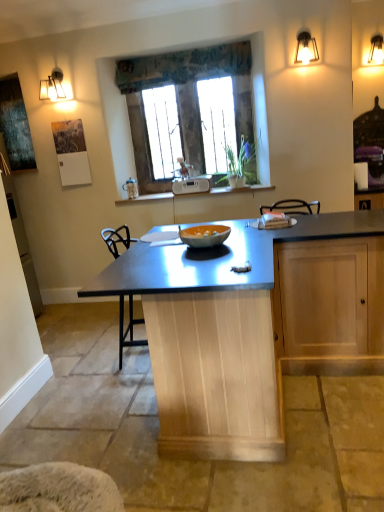
Image resolution: width=384 pixels, height=512 pixels. I want to click on white plastic radio at center, so click(x=191, y=186).

Where is `metallic wall sconce at upper right`? The height and width of the screenshot is (512, 384). metallic wall sconce at upper right is located at coordinates (306, 49).

Where is `white plastic radio at center`? This screenshot has width=384, height=512. white plastic radio at center is located at coordinates (191, 186).

Consider the image. Between white plastic radio at center and stone textured window at center, which one has smaller width?

With smaller width is stone textured window at center.

From the image's perspective, which is below, white plastic radio at center or stone textured window at center?

white plastic radio at center.

In the scene shown: Would you consider white plastic radio at center to be distant from stone textured window at center?

No, there isn't a large distance between white plastic radio at center and stone textured window at center.

Does point (193, 189) come in front of point (169, 113)?

Yes, point (193, 189) is closer to viewer.

Is textured fabric valance at upper center in front of metallic blue table at center?

No, it is not.

Is point (230, 73) positioned before point (177, 397)?

No, it is not.

Who is taller, textured fabric valance at upper center or metallic blue table at center?

metallic blue table at center is taller.

Are textured fabric valance at upper center and metallic blue table at center making contact?

No, textured fabric valance at upper center is not next to metallic blue table at center.

From the picture: Is textured fabric valance at upper center at the left side of stone textured window at center?

Correct, you'll find textured fabric valance at upper center to the left of stone textured window at center.

I want to click on curtain above the stone textured window at center (from the image's perspective), so click(x=183, y=66).

From the picture: Between textured fabric valance at upper center and stone textured window at center, which one has less height?

Standing shorter between the two is textured fabric valance at upper center.

Would you say stone textured window at center is part of textured fabric valance at upper center's contents?

That's incorrect, stone textured window at center is not inside textured fabric valance at upper center.

Can metallic wall sconce at upper right be found inside metallic blue table at center?

Actually, metallic wall sconce at upper right is outside metallic blue table at center.

Considering the sizes of metallic blue table at center and metallic wall sconce at upper right in the image, is metallic blue table at center wider or thinner than metallic wall sconce at upper right?

Clearly, metallic blue table at center has more width compared to metallic wall sconce at upper right.

Where is `light fixture lying above the metallic blue table at center (from the image's perspective)`? The height and width of the screenshot is (512, 384). light fixture lying above the metallic blue table at center (from the image's perspective) is located at coordinates (306, 49).

Considering the relative positions of stone textured window at center and textured fabric valance at upper center in the image provided, is stone textured window at center to the right of textured fabric valance at upper center from the viewer's perspective?

Yes, stone textured window at center is to the right of textured fabric valance at upper center.

How distant is stone textured window at center from textured fabric valance at upper center?

stone textured window at center and textured fabric valance at upper center are 9.59 inches apart from each other.

Based on the photo, from a real-world perspective, which object rests below the other?

stone textured window at center.

Considering the positions of point (228, 121) and point (191, 71), is point (228, 121) closer or farther from the camera than point (191, 71)?

Point (228, 121) is positioned farther from the camera compared to point (191, 71).

Is textured fabric valance at upper center looking in the opposite direction of orange matte glass bowl at center?

That's not correct — textured fabric valance at upper center is not looking away from orange matte glass bowl at center.

The height and width of the screenshot is (512, 384). Identify the location of curtain that is above the orange matte glass bowl at center (from a real-world perspective). (183, 66).

Which point is more forward, (142,84) or (198,247)?

The point (198,247) is closer.

From a real-world perspective, is orange matte glass bowl at center on top of metallic wall sconce at upper right?

Actually, orange matte glass bowl at center is physically below metallic wall sconce at upper right in the real world.

What's the angular difference between orange matte glass bowl at center and metallic wall sconce at upper right's facing directions?

The angular difference between orange matte glass bowl at center and metallic wall sconce at upper right is 91.6 degrees.

Does orange matte glass bowl at center lie in front of metallic wall sconce at upper right?

Yes, orange matte glass bowl at center is in front of metallic wall sconce at upper right.

This screenshot has height=512, width=384. I want to click on window located on the left of white plastic radio at center, so click(x=190, y=111).

The width and height of the screenshot is (384, 512). In order to click on kitchen & dining room table below the textured fabric valance at upper center (from a real-world perspective) in this screenshot , I will do `click(253, 326)`.

Looking at the image, which one is located closer to stone textured window at center, metallic blue table at center or orange matte glass bowl at center?

The object closer to stone textured window at center is orange matte glass bowl at center.

When comparing their distances from stone textured window at center, does metallic wall sconce at upper right or metallic blue table at center seem further?

metallic blue table at center.

When comparing their distances from orange matte glass bowl at center, does stone textured window at center or textured fabric valance at upper center seem closer?

Based on the image, stone textured window at center appears to be nearer to orange matte glass bowl at center.

Considering their positions, is metallic wall sconce at upper right positioned further to stone textured window at center than orange matte glass bowl at center?

orange matte glass bowl at center.

When comparing their distances from orange matte glass bowl at center, does metallic wall sconce at upper right or stone textured window at center seem further?

metallic wall sconce at upper right is positioned further to the anchor orange matte glass bowl at center.

From the image, which object appears to be nearer to metallic wall sconce at upper right, metallic blue table at center or white plastic radio at center?

white plastic radio at center is closer to metallic wall sconce at upper right.

Considering their positions, is metallic wall sconce at upper right positioned closer to orange matte glass bowl at center than textured fabric valance at upper center?

The object closer to orange matte glass bowl at center is metallic wall sconce at upper right.

Based on their spatial positions, is metallic wall sconce at upper right or textured fabric valance at upper center closer to stone textured window at center?

Among the two, textured fabric valance at upper center is located nearer to stone textured window at center.

In order to click on window between metallic wall sconce at upper right and orange matte glass bowl at center in the up-down direction in this screenshot , I will do `click(190, 111)`.

Where is `window between metallic wall sconce at upper right and metallic blue table at center vertically`? window between metallic wall sconce at upper right and metallic blue table at center vertically is located at coordinates (190, 111).

Where is `glass bowl between textured fabric valance at upper center and metallic blue table at center from top to bottom`? This screenshot has width=384, height=512. glass bowl between textured fabric valance at upper center and metallic blue table at center from top to bottom is located at coordinates (204, 234).

The width and height of the screenshot is (384, 512). Identify the location of window that lies between textured fabric valance at upper center and orange matte glass bowl at center from top to bottom. (190, 111).